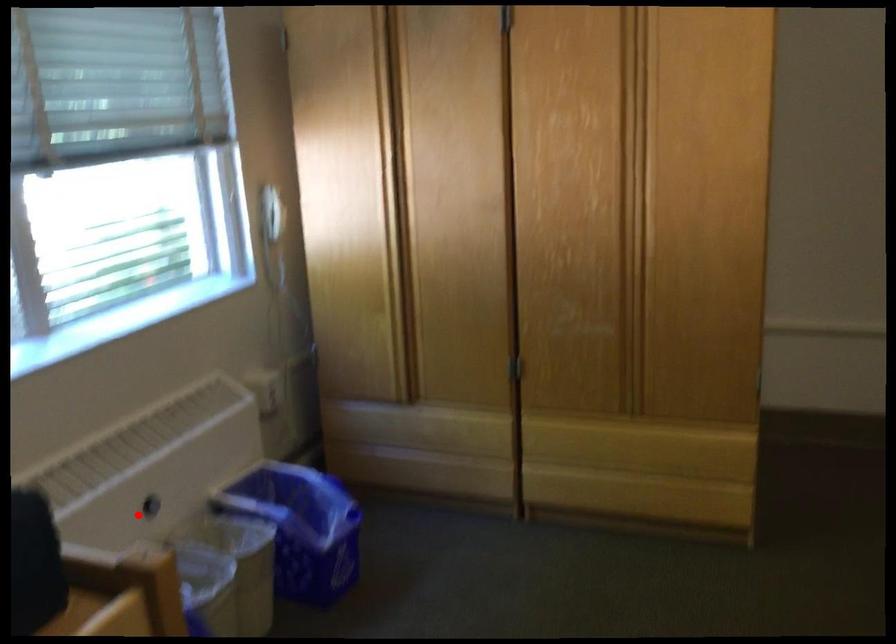
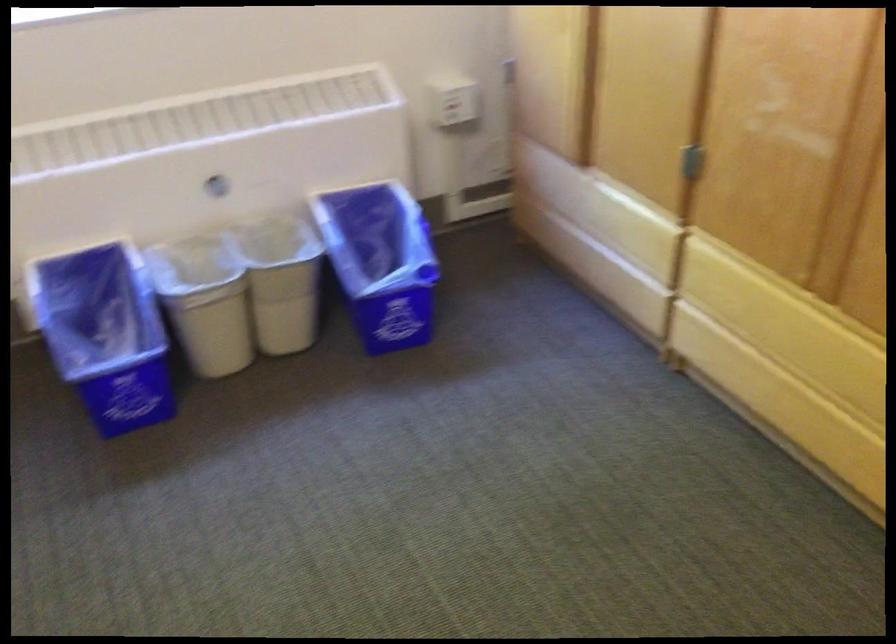
Where in the second image is the point corresponding to the highlighted location from the first image?

(218, 187)